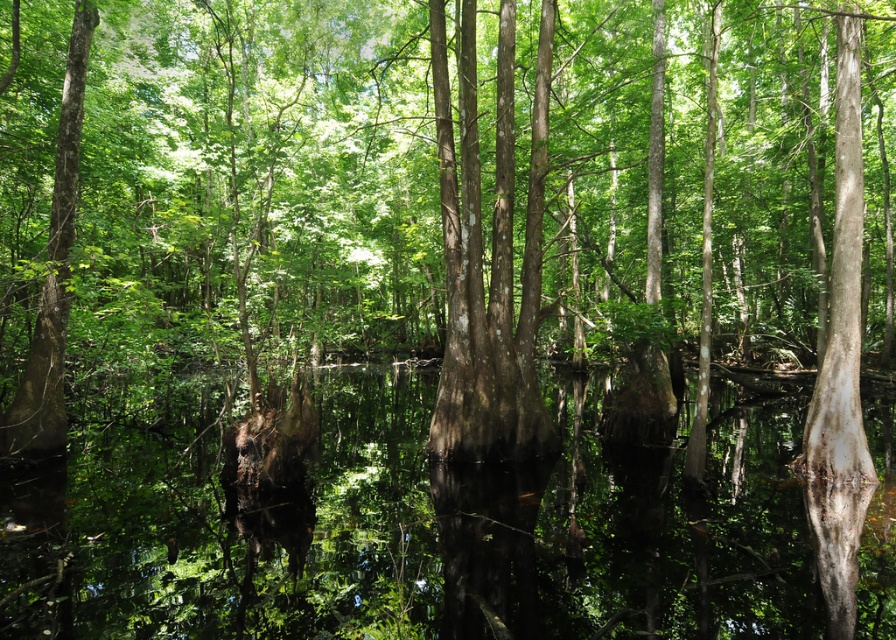
Looking at this image, you are a nature photographer planning to capture the smooth bark tree at center and the transparent water at center in a single frame. Based on their sizes, which object will occupy more space in your photo?

The smooth bark tree at center has a larger width than the transparent water at center, so it will occupy more space in the photo.